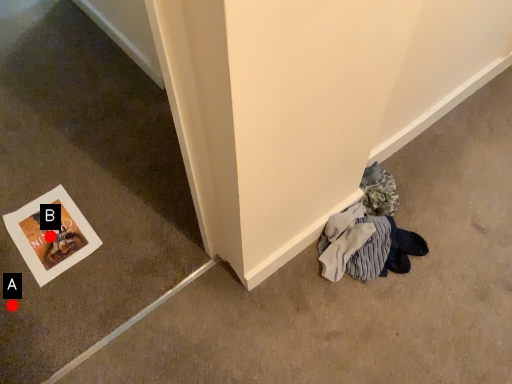
Question: Two points are circled on the image, labeled by A and B beside each circle. Which point appears closest to the camera in this image?

Choices:
 (A) A is closer
 (B) B is closer

Answer: (A)